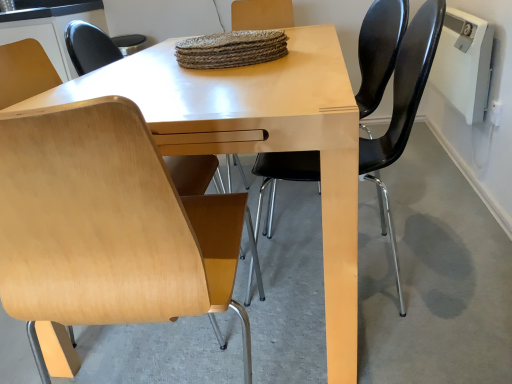
Question: Is black leather chair at right, positioned as the second chair in left-to-right order, located within beech wood chair at lower left?

Choices:
 (A) yes
 (B) no

Answer: (B)

Question: Considering the relative sizes of beech wood chair at lower left and black leather chair at right, positioned as the second chair in left-to-right order, in the image provided, is beech wood chair at lower left smaller than black leather chair at right, positioned as the second chair in left-to-right order,?

Choices:
 (A) no
 (B) yes

Answer: (B)

Question: Is beech wood chair at lower left positioned behind black leather chair at right, which appears as the first chair when viewed from the right?

Choices:
 (A) no
 (B) yes

Answer: (B)

Question: Is beech wood chair at lower left aimed at black leather chair at right, which appears as the first chair when viewed from the right?

Choices:
 (A) yes
 (B) no

Answer: (B)

Question: Is beech wood chair at lower left turned away from black leather chair at right, which appears as the first chair when viewed from the right?

Choices:
 (A) no
 (B) yes

Answer: (A)

Question: Does beech wood chair at lower left have a lesser width compared to black leather chair at right, positioned as the second chair in left-to-right order?

Choices:
 (A) no
 (B) yes

Answer: (A)

Question: Can you confirm if black leather chair at right, positioned as the second chair in left-to-right order, is taller than beech wood chair at lower left?

Choices:
 (A) yes
 (B) no

Answer: (A)

Question: From the image's perspective, does black leather chair at right, which appears as the first chair when viewed from the right, appear lower than beech wood chair at lower left?

Choices:
 (A) no
 (B) yes

Answer: (A)

Question: Is black leather chair at right, which appears as the first chair when viewed from the right, positioned beyond the bounds of beech wood chair at lower left?

Choices:
 (A) yes
 (B) no

Answer: (A)

Question: Does black leather chair at right, which appears as the first chair when viewed from the right, have a greater width compared to beech wood chair at lower left?

Choices:
 (A) yes
 (B) no

Answer: (B)

Question: Is black leather chair at right, which appears as the first chair when viewed from the right, in contact with beech wood chair at lower left?

Choices:
 (A) yes
 (B) no

Answer: (B)

Question: Is the position of black leather chair at right, which appears as the first chair when viewed from the right, less distant than that of beech wood chair at lower left?

Choices:
 (A) no
 (B) yes

Answer: (B)

Question: From a real-world perspective, is beech wood chair at lower left under beech wood chair at left, placed as the first chair when sorted from left to right?

Choices:
 (A) yes
 (B) no

Answer: (A)